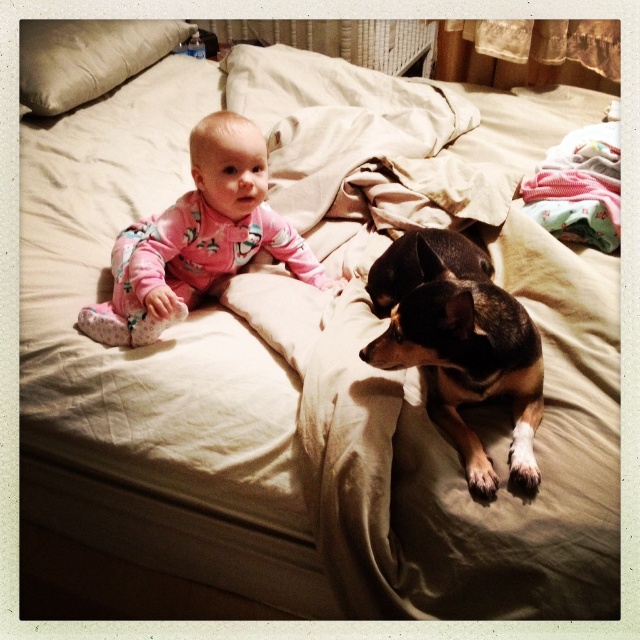
Question: Can you confirm if brown and black fur dog at center is positioned to the right of pink fleece onesie at center?

Choices:
 (A) yes
 (B) no

Answer: (A)

Question: Which point is farther to the camera?

Choices:
 (A) pos(86,33)
 (B) pos(212,186)

Answer: (A)

Question: Does pink fleece onesie at center appear over beige fabric pillow at upper left?

Choices:
 (A) yes
 (B) no

Answer: (B)

Question: Which point appears closest to the camera in this image?

Choices:
 (A) (228, 241)
 (B) (48, 58)

Answer: (A)

Question: Which point is closer to the camera?

Choices:
 (A) tap(512, 449)
 (B) tap(28, 88)

Answer: (A)

Question: Does pink fleece onesie at center appear on the right side of beige fabric pillow at upper left?

Choices:
 (A) no
 (B) yes

Answer: (B)